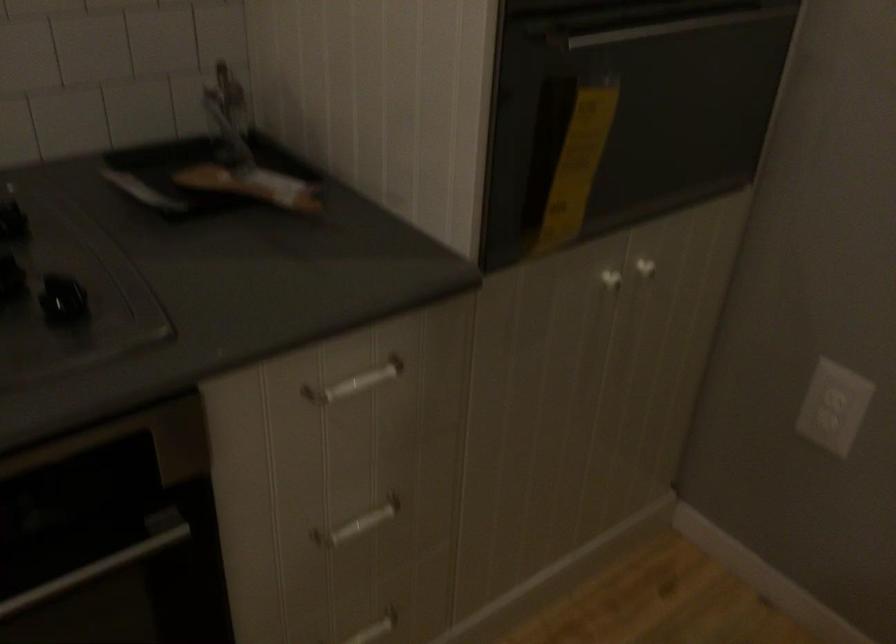
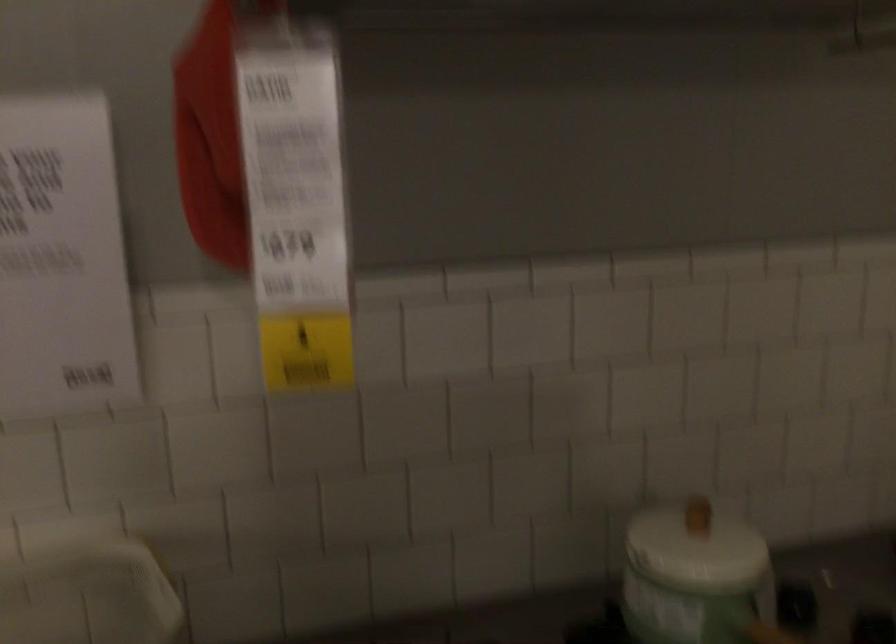
Question: Which direction would the cameraman need to move to produce the second image? Reply with the corresponding letter.

Choices:
 (A) Left
 (B) Right
 (C) Forward
 (D) Backward

Answer: (A)